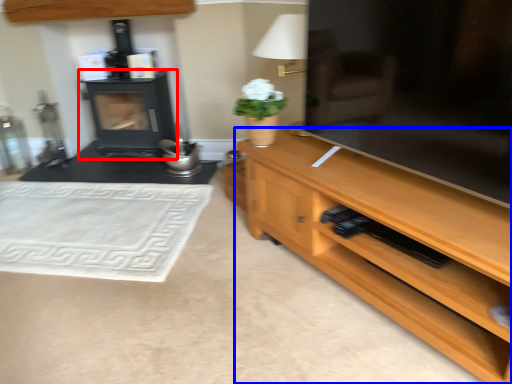
Question: Which object appears closest to the camera in this image, wood burning stove (highlighted by a red box) or desk (highlighted by a blue box)?

Choices:
 (A) wood burning stove
 (B) desk

Answer: (B)